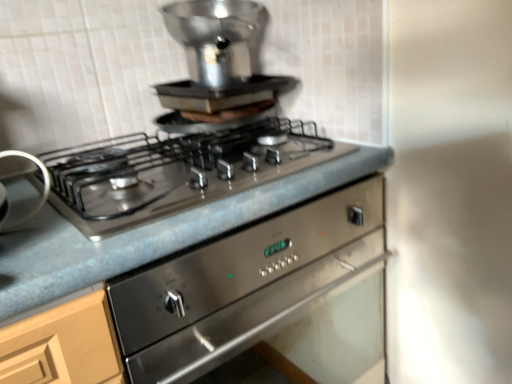
Where is `satin silver pot at upper center, which is the first appliance in back-to-front order`? The height and width of the screenshot is (384, 512). satin silver pot at upper center, which is the first appliance in back-to-front order is located at coordinates (214, 38).

The height and width of the screenshot is (384, 512). Describe the element at coordinates (214, 38) in the screenshot. I see `satin silver pot at upper center, which is the first appliance in back-to-front order` at that location.

I want to click on metallic gray countertop at center, so click(153, 234).

This screenshot has width=512, height=384. In order to click on satin silver burner at left, placed as the 2th appliance when sorted from right to left in this screenshot , I will do `click(42, 187)`.

Locate an element on the screen. stainless steel gas stove at center is located at coordinates (174, 171).

This screenshot has height=384, width=512. I want to click on satin silver pot at upper center, which is counted as the 2th appliance, starting from the left, so click(214, 38).

Which is correct: satin silver burner at left, placed as the 1th appliance when sorted from left to right, is inside satin silver pot at upper center, which is the first appliance in back-to-front order, or outside of it?

satin silver burner at left, placed as the 1th appliance when sorted from left to right, is spatially situated outside satin silver pot at upper center, which is the first appliance in back-to-front order.

Is satin silver burner at left, placed as the 2th appliance when sorted from right to left, positioned with its back to satin silver pot at upper center, which is counted as the 2th appliance, starting from the left?

No, satin silver burner at left, placed as the 2th appliance when sorted from right to left, is not facing away from satin silver pot at upper center, which is counted as the 2th appliance, starting from the left.

Relative to satin silver pot at upper center, positioned as the 1th appliance in top-to-bottom order, is satin silver burner at left, which is the 2th appliance in back-to-front order, in front or behind?

satin silver burner at left, which is the 2th appliance in back-to-front order, is positioned closer to the viewer than satin silver pot at upper center, positioned as the 1th appliance in top-to-bottom order.

From the image's perspective, is satin silver burner at left, placed as the 1th appliance when sorted from left to right, above or below satin silver pot at upper center, which is the first appliance in back-to-front order?

satin silver burner at left, placed as the 1th appliance when sorted from left to right, is below satin silver pot at upper center, which is the first appliance in back-to-front order.

From a real-world perspective, is stainless steel gas stove at center under satin silver burner at left, which is counted as the second appliance, starting from the top?

Yes, from a real-world perspective, stainless steel gas stove at center is under satin silver burner at left, which is counted as the second appliance, starting from the top.

Is stainless steel gas stove at center not inside satin silver burner at left, which is the 2th appliance in back-to-front order?

stainless steel gas stove at center lies outside satin silver burner at left, which is the 2th appliance in back-to-front order,'s area.

Which object is positioned more to the right, stainless steel gas stove at center or satin silver burner at left, placed as the 1th appliance when sorted from left to right?

Positioned to the right is stainless steel gas stove at center.

Between point (89, 220) and point (42, 189), which one is positioned behind?

The point (42, 189) is more distant.

Which object is closer to the camera, metallic gray countertop at center or satin silver burner at left, placed as the 1th appliance when sorted from left to right?

metallic gray countertop at center is in front.

Consider the image. Which object is wider, metallic gray countertop at center or satin silver burner at left, placed as the 2th appliance when sorted from right to left?

metallic gray countertop at center.

Looking at this image, considering the sizes of objects metallic gray countertop at center and satin silver burner at left, placed as the 1th appliance when sorted from left to right, in the image provided, who is taller, metallic gray countertop at center or satin silver burner at left, placed as the 1th appliance when sorted from left to right,?

With more height is metallic gray countertop at center.

Is point (87, 291) more distant than point (17, 155)?

No, (87, 291) is closer to viewer.

Looking at this image, how distant is satin silver burner at left, which is counted as the second appliance, starting from the top, from metallic gray countertop at center?

satin silver burner at left, which is counted as the second appliance, starting from the top, and metallic gray countertop at center are 9.69 inches apart.

Are satin silver burner at left, which is counted as the second appliance, starting from the top, and metallic gray countertop at center beside each other?

satin silver burner at left, which is counted as the second appliance, starting from the top, and metallic gray countertop at center are clearly separated.

From a real-world perspective, between satin silver burner at left, the first appliance positioned from the bottom, and metallic gray countertop at center, who is vertically lower?

metallic gray countertop at center is physically lower.

Is satin silver burner at left, the first appliance positioned from the bottom, spatially inside metallic gray countertop at center, or outside of it?

satin silver burner at left, the first appliance positioned from the bottom, is outside metallic gray countertop at center.

Which object is further away from the camera taking this photo, satin silver pot at upper center, which is the first appliance in back-to-front order, or metallic gray countertop at center?

satin silver pot at upper center, which is the first appliance in back-to-front order, is further away from the camera.

From a real-world perspective, which object stands above the other?

From a 3D spatial view, satin silver pot at upper center, which appears as the second appliance when ordered from the bottom, is above.

Is satin silver pot at upper center, the first appliance in the right-to-left sequence, inside or outside of metallic gray countertop at center?

satin silver pot at upper center, the first appliance in the right-to-left sequence, cannot be found inside metallic gray countertop at center.

Who is shorter, satin silver pot at upper center, positioned as the 1th appliance in top-to-bottom order, or metallic gray countertop at center?

Standing shorter between the two is satin silver pot at upper center, positioned as the 1th appliance in top-to-bottom order.

Is satin silver pot at upper center, the second appliance positioned from the front, thinner than stainless steel gas stove at center?

Yes, satin silver pot at upper center, the second appliance positioned from the front, is thinner than stainless steel gas stove at center.

Is satin silver pot at upper center, which appears as the second appliance when ordered from the bottom, at the right side of stainless steel gas stove at center?

Indeed, satin silver pot at upper center, which appears as the second appliance when ordered from the bottom, is positioned on the right side of stainless steel gas stove at center.

Considering the relative sizes of satin silver pot at upper center, which appears as the second appliance when ordered from the bottom, and stainless steel gas stove at center in the image provided, is satin silver pot at upper center, which appears as the second appliance when ordered from the bottom, bigger than stainless steel gas stove at center?

Yes, satin silver pot at upper center, which appears as the second appliance when ordered from the bottom, is bigger than stainless steel gas stove at center.

Consider the image. From the image's perspective, which is above, stainless steel gas stove at center or metallic gray countertop at center?

stainless steel gas stove at center, from the image's perspective.

Is point (318, 154) closer to camera compared to point (341, 148)?

Yes.

Based on the photo, considering the relative sizes of stainless steel gas stove at center and metallic gray countertop at center in the image provided, is stainless steel gas stove at center bigger than metallic gray countertop at center?

Incorrect, stainless steel gas stove at center is not larger than metallic gray countertop at center.

Which of these two, stainless steel gas stove at center or metallic gray countertop at center, is thinner?

stainless steel gas stove at center.

You are a GUI agent. You are given a task and a screenshot of the screen. Output one action in this format:
    pyautogui.click(x=<x>, y=<y>)
    Task: Click on the appliance in front of the satin silver pot at upper center, the first appliance in the right-to-left sequence
    
    Given the screenshot: What is the action you would take?
    pyautogui.click(x=42, y=187)

This screenshot has height=384, width=512. What are the coordinates of `gas stove below the satin silver burner at left, which is the 2th appliance in back-to-front order (from a real-world perspective)` in the screenshot? It's located at (174, 171).

Estimate the real-world distances between objects in this image. Which object is further from satin silver pot at upper center, which is counted as the 2th appliance, starting from the left, satin silver burner at left, which is the 2th appliance in back-to-front order, or stainless steel gas stove at center?

Based on the image, satin silver burner at left, which is the 2th appliance in back-to-front order, appears to be further to satin silver pot at upper center, which is counted as the 2th appliance, starting from the left.

From the image, which object appears to be farther from satin silver burner at left, the first appliance positioned from the bottom, metallic gray countertop at center or stainless steel gas stove at center?

Among the two, metallic gray countertop at center is located further to satin silver burner at left, the first appliance positioned from the bottom.

When comparing their distances from satin silver burner at left, the 1th appliance from the front, does metallic gray countertop at center or satin silver pot at upper center, positioned as the 1th appliance in top-to-bottom order, seem closer?

metallic gray countertop at center is positioned closer to the anchor satin silver burner at left, the 1th appliance from the front.

Consider the image. From the image, which object appears to be farther from metallic gray countertop at center, stainless steel gas stove at center or satin silver burner at left, the first appliance positioned from the bottom?

The object further to metallic gray countertop at center is satin silver burner at left, the first appliance positioned from the bottom.

Which object lies nearer to the anchor point satin silver burner at left, which is counted as the second appliance, starting from the top, satin silver pot at upper center, which appears as the second appliance when ordered from the bottom, or metallic gray countertop at center?

metallic gray countertop at center is positioned closer to the anchor satin silver burner at left, which is counted as the second appliance, starting from the top.

Based on their spatial positions, is metallic gray countertop at center or satin silver burner at left, the first appliance positioned from the bottom, closer to stainless steel gas stove at center?

The object closer to stainless steel gas stove at center is metallic gray countertop at center.

Based on their spatial positions, is satin silver burner at left, the 1th appliance from the front, or satin silver pot at upper center, which is counted as the 2th appliance, starting from the left, further from metallic gray countertop at center?

The object further to metallic gray countertop at center is satin silver pot at upper center, which is counted as the 2th appliance, starting from the left.

Which object lies nearer to the anchor point satin silver pot at upper center, which is counted as the 2th appliance, starting from the left, metallic gray countertop at center or stainless steel gas stove at center?

Among the two, stainless steel gas stove at center is located nearer to satin silver pot at upper center, which is counted as the 2th appliance, starting from the left.

Find the location of a particular element. appliance between stainless steel gas stove at center and metallic gray countertop at center vertically is located at coordinates (42, 187).

Where is `gas stove between satin silver pot at upper center, the second appliance positioned from the front, and satin silver burner at left, the first appliance positioned from the bottom, in the vertical direction`? This screenshot has width=512, height=384. gas stove between satin silver pot at upper center, the second appliance positioned from the front, and satin silver burner at left, the first appliance positioned from the bottom, in the vertical direction is located at coordinates (174, 171).

This screenshot has height=384, width=512. Identify the location of gas stove that lies between satin silver pot at upper center, which is counted as the 2th appliance, starting from the left, and metallic gray countertop at center from top to bottom. (174, 171).

Identify the location of appliance between satin silver pot at upper center, positioned as the 1th appliance in top-to-bottom order, and metallic gray countertop at center from top to bottom. This screenshot has width=512, height=384. (42, 187).